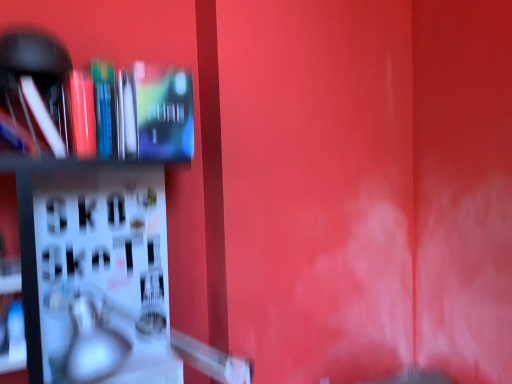
In order to click on matte plastic book at upper left in this screenshot , I will do `click(164, 112)`.

Describe the element at coordinates (164, 112) in the screenshot. The height and width of the screenshot is (384, 512). I see `matte plastic book at upper left` at that location.

Where is `matte plastic book at upper left`? This screenshot has width=512, height=384. matte plastic book at upper left is located at coordinates (164, 112).